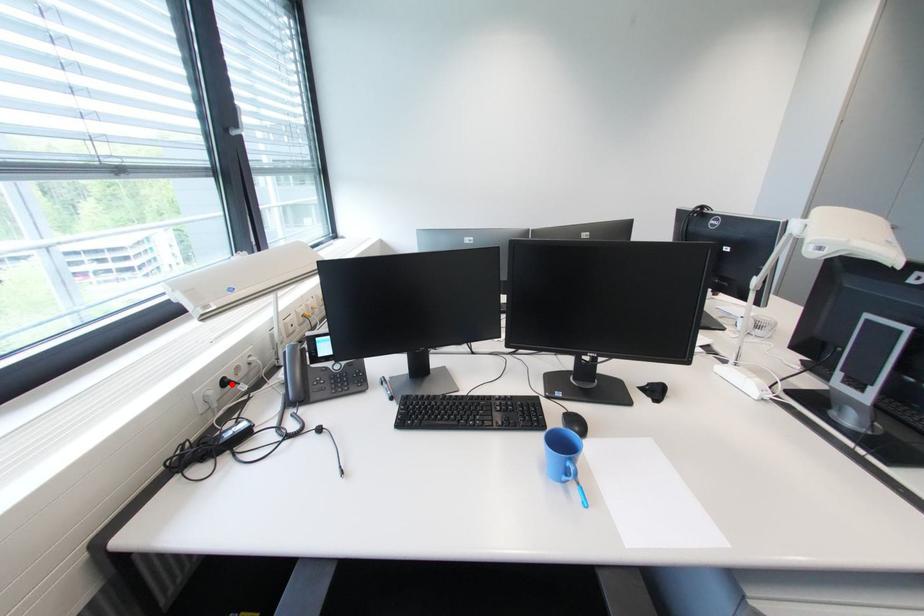
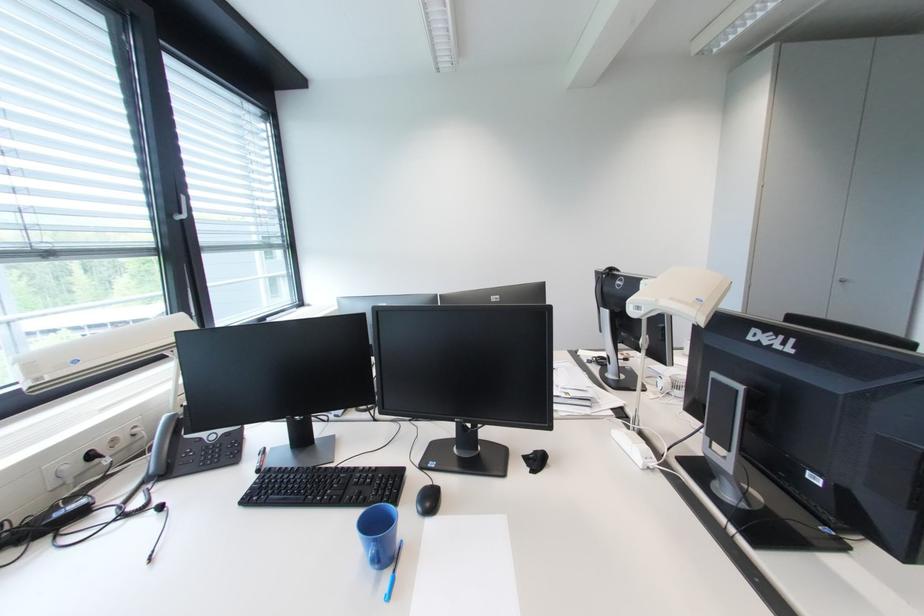
Locate, in the second image, the point that corresponds to the highlighted location in the first image.

(98, 458)